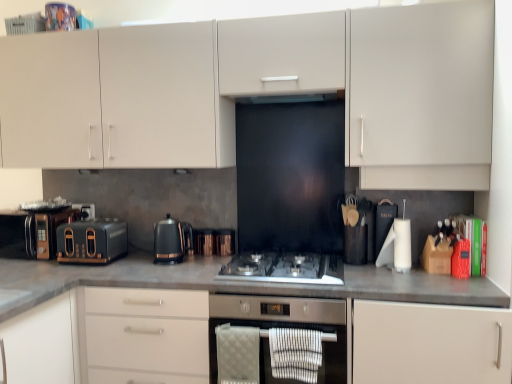
Locate an element on the screen. vacant space positioned to the left of metallic copper kettle at center, which is the third appliance in left-to-right order is located at coordinates (200, 252).